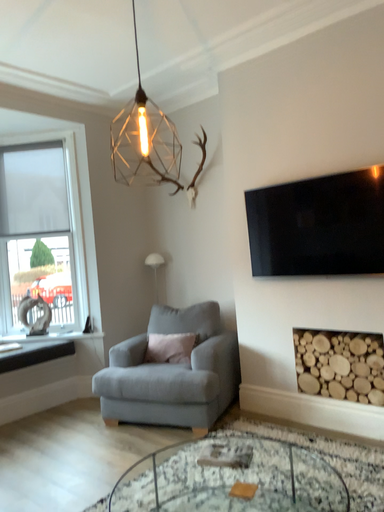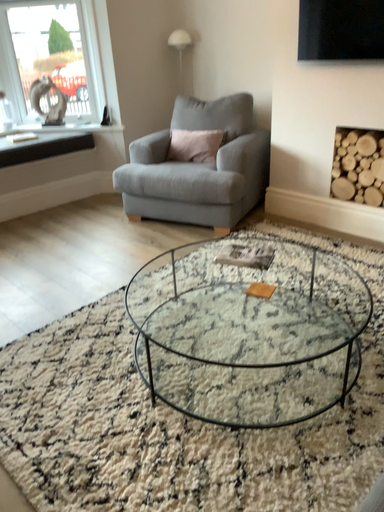
Question: How did the camera likely rotate when shooting the video?

Choices:
 (A) rotated upward
 (B) rotated downward

Answer: (B)